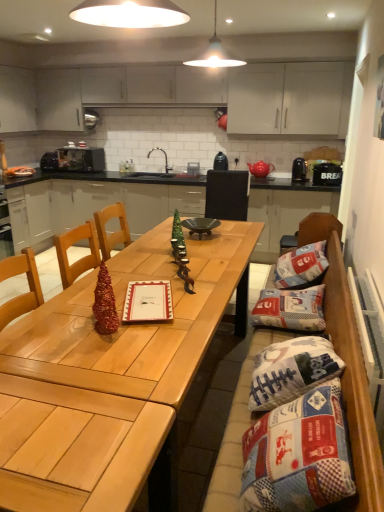
Where is `vacant area that lies to the right of shiny metallic christmas tree at center, placed as the 2th christmas tree when sorted from right to left`? The width and height of the screenshot is (384, 512). vacant area that lies to the right of shiny metallic christmas tree at center, placed as the 2th christmas tree when sorted from right to left is located at coordinates (152, 336).